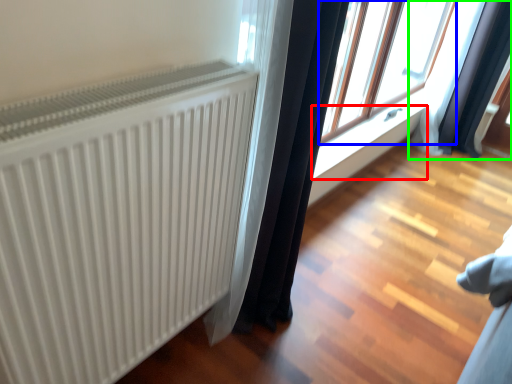
Question: Which object is the farthest from window sill (highlighted by a red box)? Choose among these: window (highlighted by a blue box) or curtain (highlighted by a green box).

Choices:
 (A) window
 (B) curtain

Answer: (B)